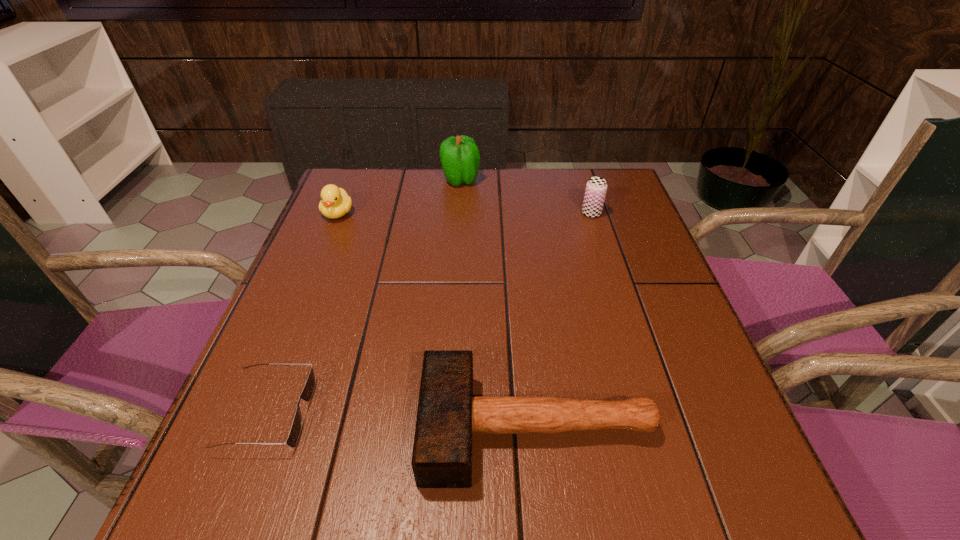
In order to click on bell pepper in this screenshot , I will do `click(460, 157)`.

This screenshot has width=960, height=540. I want to click on the tallest object, so click(x=460, y=157).

At what (x,y) coordinates should I click in order to perform the action: click on beer can. Please return your answer as a coordinate pair (x, y). This screenshot has height=540, width=960. Looking at the image, I should click on (596, 187).

Where is `duckling`? This screenshot has height=540, width=960. duckling is located at coordinates (335, 202).

This screenshot has height=540, width=960. I want to click on mallet, so (x=448, y=414).

You are a GUI agent. You are given a task and a screenshot of the screen. Output one action in this format:
    pyautogui.click(x=<x>, y=<y>)
    Task: Click on the sunglasses
    This screenshot has width=960, height=540.
    Given the screenshot: What is the action you would take?
    pyautogui.click(x=306, y=395)

The width and height of the screenshot is (960, 540). Find the location of `free space located 0.200m on the front of the tallest object`. free space located 0.200m on the front of the tallest object is located at coordinates (457, 233).

In order to click on free region located 0.200m on the front of the beer can in this screenshot , I will do `click(610, 270)`.

Identify the location of blank space located on the beak of the duckling. The width and height of the screenshot is (960, 540). (323, 251).

You are a GUI agent. You are given a task and a screenshot of the screen. Output one action in this format:
    pyautogui.click(x=<x>, y=<y>)
    Task: Click on the vacant region located 0.080m on the hammer head face of the mallet
    
    Given the screenshot: What is the action you would take?
    pyautogui.click(x=374, y=428)